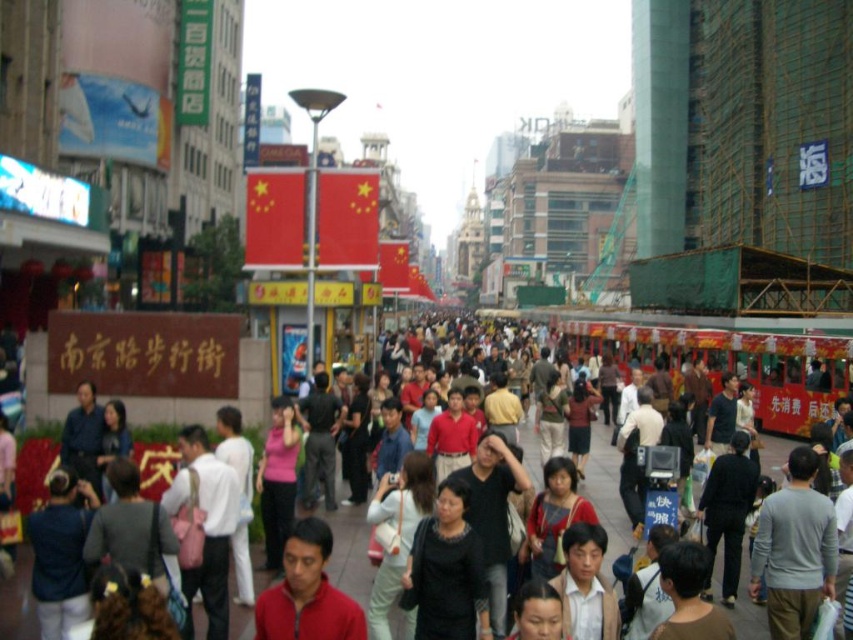
You are standing at the origin point in the image. There is a matte black crowd at center at point (606, 492). Where is the matte black crowd at center located relative to your position?

The matte black crowd at center is located at point (606, 492) relative to your position.

You are a delivery robot with a GPS coordinate of point 0.770, 0.712. You need to deliver a package to the nearest available person in the matte black crowd at center. Which direction should you move to find the nearest person?

The nearest person would be in the direction of the matte black crowd at center since the crowd is located at point (606, 492), which matches your current GPS coordinate.

Looking at this image, you are standing in the middle of the bustling pedestrian street and want to take a photo of both the point at [746,618] and the point at [294,572]. Which point will appear closer to the camera in the photo?

Point [294,572] will appear closer to the camera in the photo because it is physically closer to the camera than point [746,618], which is further away.